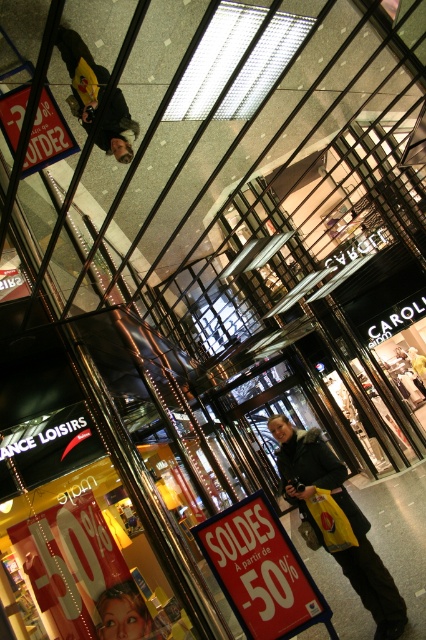
You are standing in the shopping mall and want to reach a point marked at coordinates (218, 566). If your current position is 3 meters away from that point, how much further do you need to walk to reach it?

The distance of point (218, 566) from viewer is 3.95 meters. Since you are currently 3 meters away, you need to walk an additional 0.95 meters to reach the point.

You are a customer in the mall and want to read the text on the red paper sign at center. However, you notice the dark green jacket at center is blocking your view. Can you tell me which object is closer to you based on their sizes?

The red paper sign at center has a smaller size compared to the dark green jacket at center, so the dark green jacket at center is closer to you since closer objects appear larger.